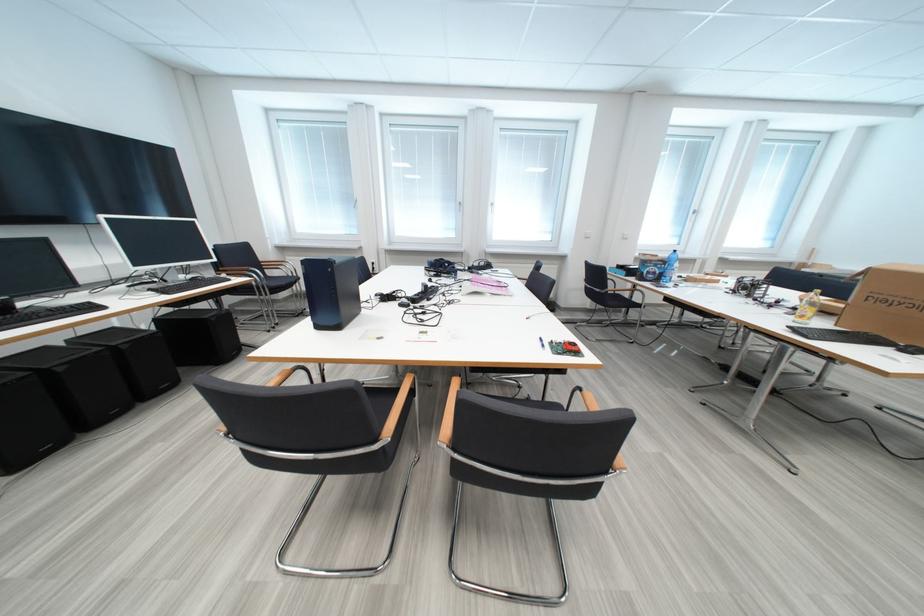
The location [670,267] corresponds to which object?

This point indicates the clear water bottle.